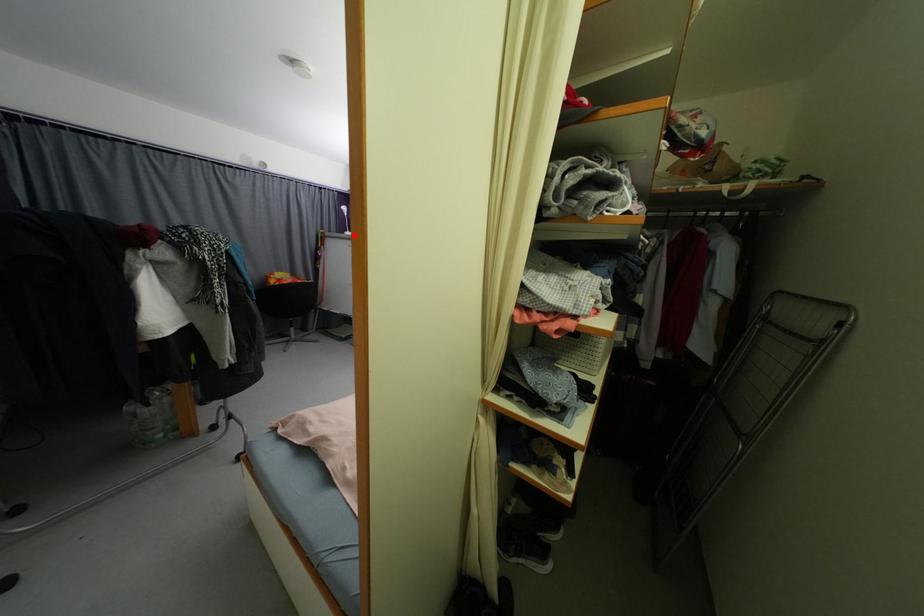
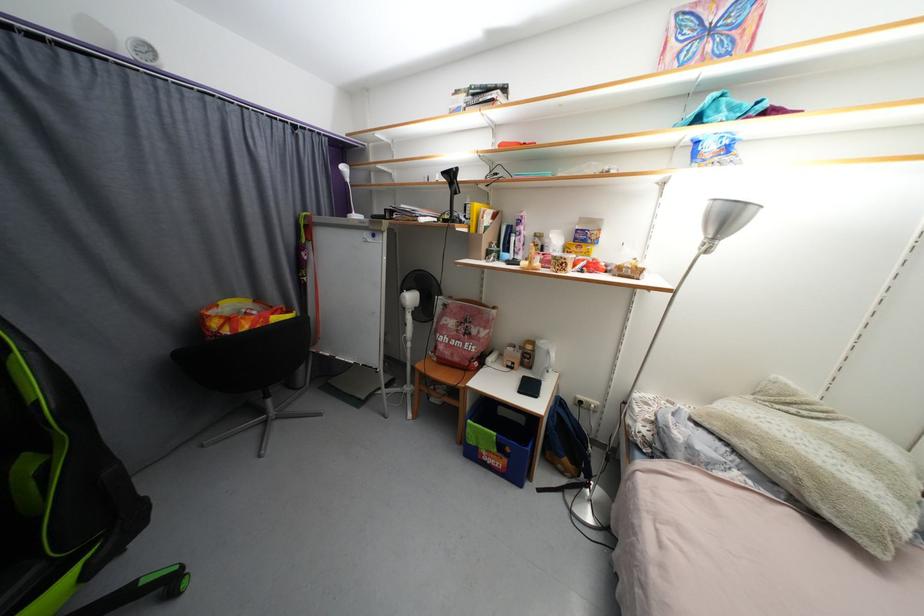
Where in the second image is the point corresponding to the highlighted location from the first image?

(360, 217)